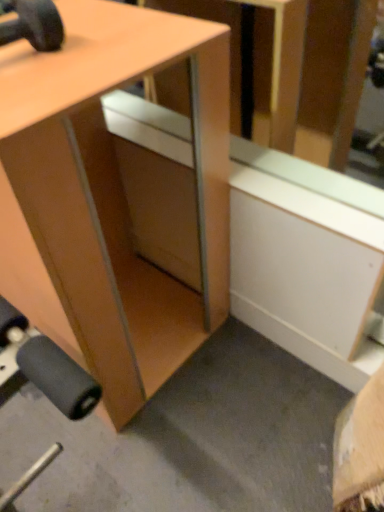
Locate an element on the screen. Image resolution: width=384 pixels, height=512 pixels. free point above matte wood desk at center (from a real-world perspective) is located at coordinates (77, 40).